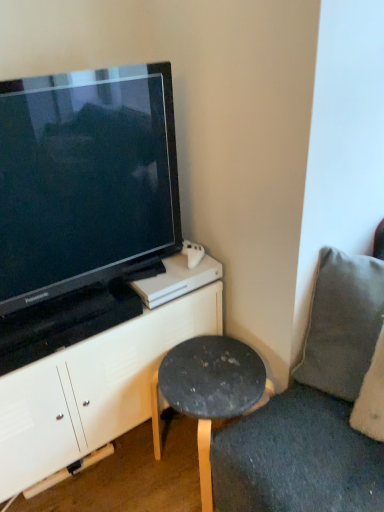
Question: Is point (160, 371) closer or farther from the camera than point (155, 317)?

Choices:
 (A) farther
 (B) closer

Answer: (B)

Question: Relative to white matte cabinet at upper left, is dark gray stone stool at lower right in front or behind?

Choices:
 (A) behind
 (B) front

Answer: (A)

Question: Estimate the real-world distances between objects in this image. Which object is closer to the gray fabric pillow at right?

Choices:
 (A) dark gray stone stool at lower right
 (B) black glossy television at upper left
 (C) white matte cabinet at upper left

Answer: (A)

Question: Estimate the real-world distances between objects in this image. Which object is closer to the dark gray stone stool at lower right?

Choices:
 (A) black glossy television at upper left
 (B) white matte cabinet at upper left
 (C) gray fabric pillow at right

Answer: (B)